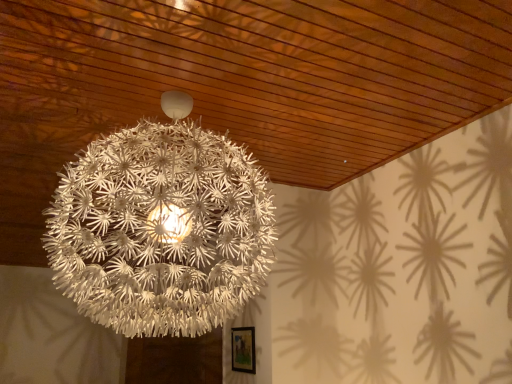
Question: Is white matte spherical lamp at center in front of or behind wooden framed picture at lower center in the image?

Choices:
 (A) behind
 (B) front

Answer: (B)

Question: Does point (68, 220) appear closer or farther from the camera than point (237, 342)?

Choices:
 (A) farther
 (B) closer

Answer: (B)

Question: In terms of height, does white matte spherical lamp at center look taller or shorter compared to wooden framed picture at lower center?

Choices:
 (A) tall
 (B) short

Answer: (A)

Question: From a real-world perspective, is wooden framed picture at lower center above or below white matte spherical lamp at center?

Choices:
 (A) below
 (B) above

Answer: (A)

Question: Is wooden framed picture at lower center inside or outside of white matte spherical lamp at center?

Choices:
 (A) outside
 (B) inside

Answer: (A)

Question: In the image, is wooden framed picture at lower center positioned in front of or behind white matte spherical lamp at center?

Choices:
 (A) behind
 (B) front

Answer: (A)

Question: Is wooden framed picture at lower center taller or shorter than white matte spherical lamp at center?

Choices:
 (A) short
 (B) tall

Answer: (A)